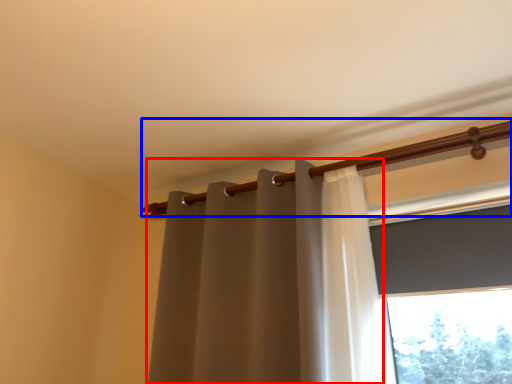
Question: Which of the following is the farthest to the observer, curtain (highlighted by a red box) or beam (highlighted by a blue box)?

Choices:
 (A) curtain
 (B) beam

Answer: (B)